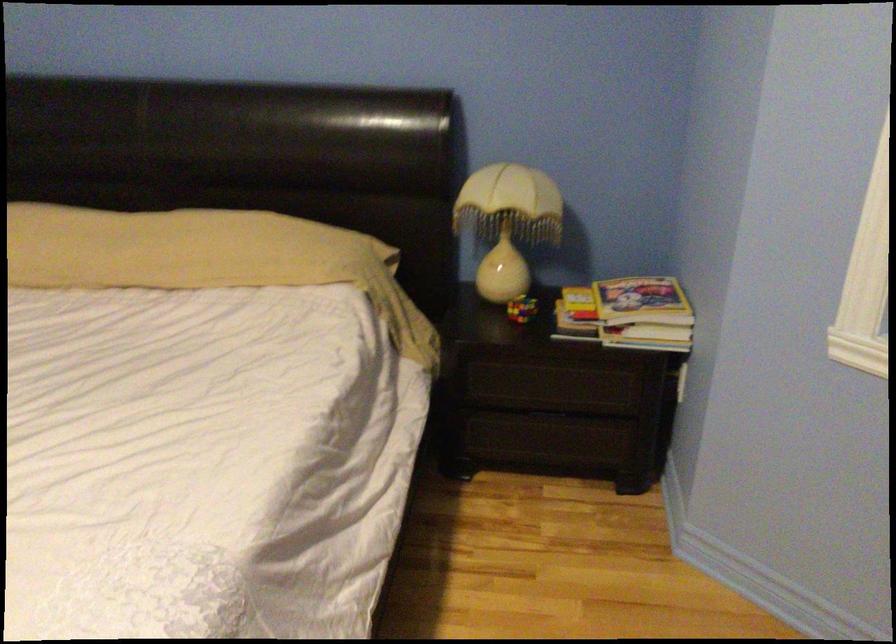
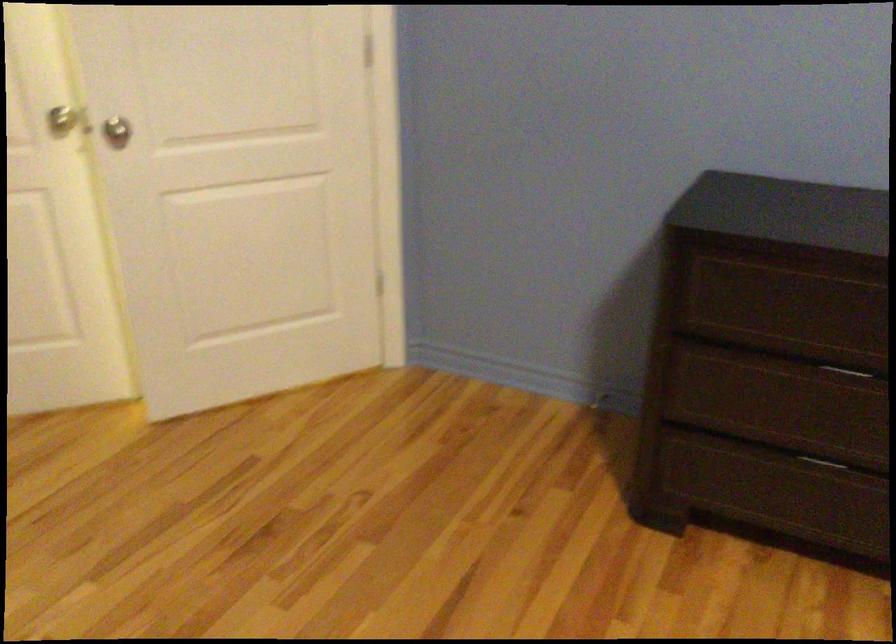
First-person continuous shooting, in which direction is the camera rotating?

The rotation direction of the camera is left-down.